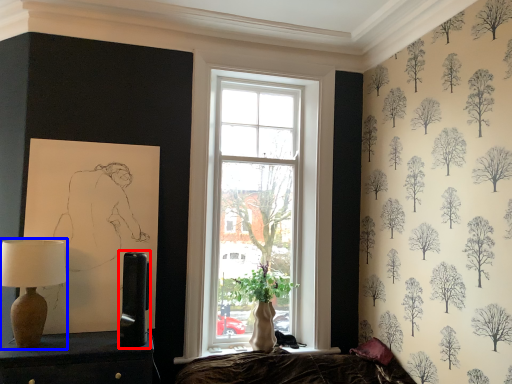
Question: Which point is closer to the camera, table lamp (highlighted by a red box) or table lamp (highlighted by a blue box)?

Choices:
 (A) table lamp
 (B) table lamp

Answer: (B)